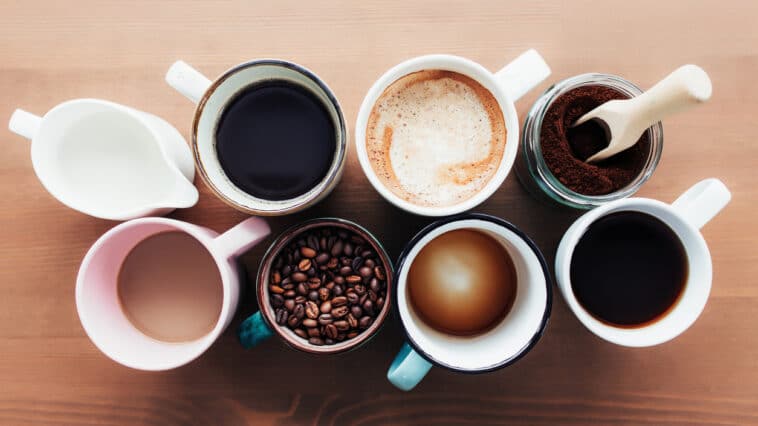
At what (x,y) coordinates should I click in order to perform the action: click on cup. Please return your answer as a coordinate pair (x, y). This screenshot has height=426, width=758. Looking at the image, I should click on (215, 245), (174, 158), (280, 209), (508, 109), (697, 216), (528, 290), (352, 339).